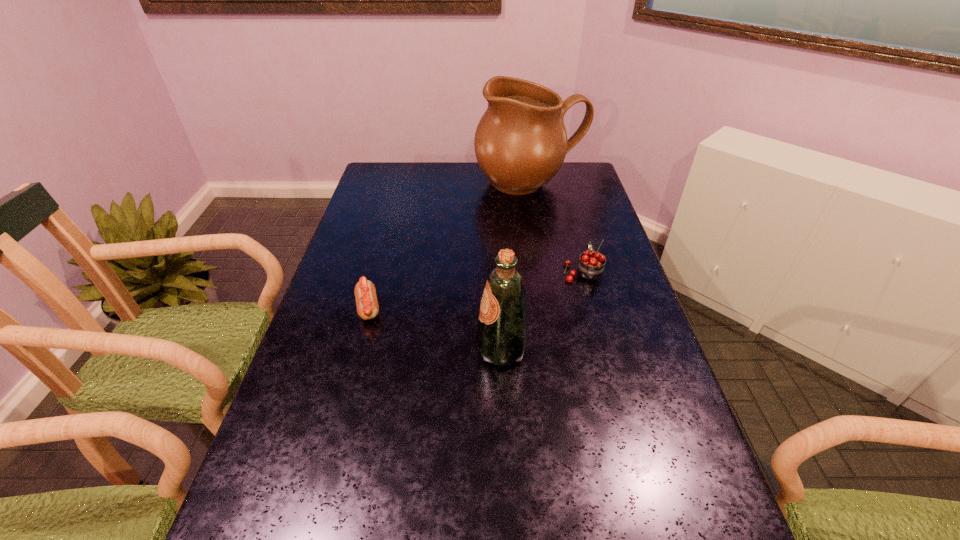
Locate an element on the screen. The height and width of the screenshot is (540, 960). unoccupied position between the olive oil and the farthest object is located at coordinates (516, 267).

Locate an element on the screen. This screenshot has height=540, width=960. free point between the farthest object and the olive oil is located at coordinates (516, 267).

The image size is (960, 540). I want to click on free space between the cream pitcher and the cherry, so click(x=557, y=228).

Where is `free point between the cherry and the second tallest object`? Image resolution: width=960 pixels, height=540 pixels. free point between the cherry and the second tallest object is located at coordinates (542, 310).

At what (x,y) coordinates should I click in order to perform the action: click on free space between the cream pitcher and the third nearest object. Please return your answer as a coordinate pair (x, y). The image size is (960, 540). Looking at the image, I should click on (557, 228).

Identify which object is the third closest to the cherry. Please provide its 2D coordinates. Your answer should be formatted as a tuple, i.e. [(x, y)], where the tuple contains the x and y coordinates of a point satisfying the conditions above.

[(365, 292)]

What are the coordinates of `the closest object to the cream pitcher` in the screenshot? It's located at (591, 266).

Where is `vacant region that satisfies the following two spatial constraints: 1. at the spout of the cream pitcher; 2. on the front-facing side of the third shortest object`? vacant region that satisfies the following two spatial constraints: 1. at the spout of the cream pitcher; 2. on the front-facing side of the third shortest object is located at coordinates (560, 349).